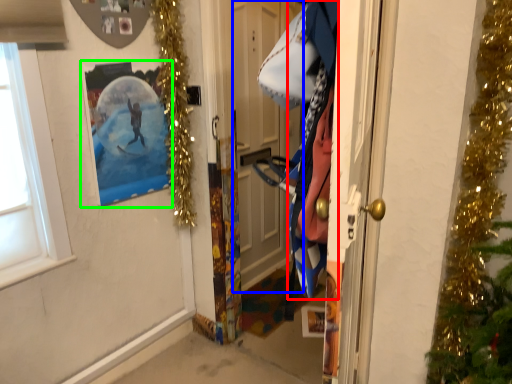
Question: Based on their relative distances, which object is nearer to clothing (highlighted by a red box)? Choose from door (highlighted by a blue box) and picture frame (highlighted by a green box).

Choices:
 (A) door
 (B) picture frame

Answer: (B)